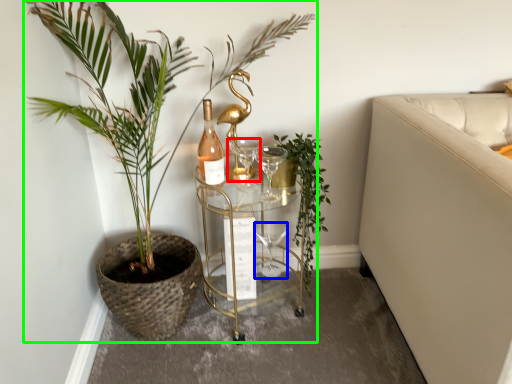
Question: Which object is the farthest from wine glass (highlighted by a red box)? Choose among these: wine glass (highlighted by a blue box) or houseplant (highlighted by a green box).

Choices:
 (A) wine glass
 (B) houseplant

Answer: (A)